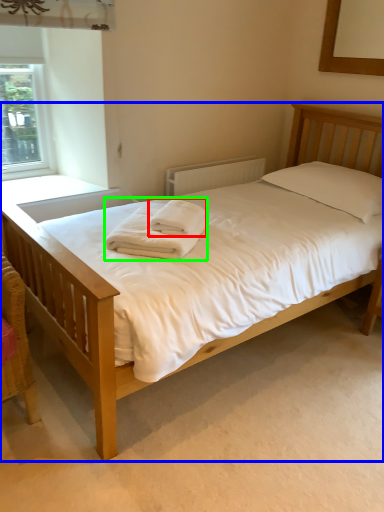
Question: Based on their relative distances, which object is farther from bath towel (highlighted by a red box)? Choose from bed (highlighted by a blue box) and bath towel (highlighted by a green box).

Choices:
 (A) bed
 (B) bath towel

Answer: (A)